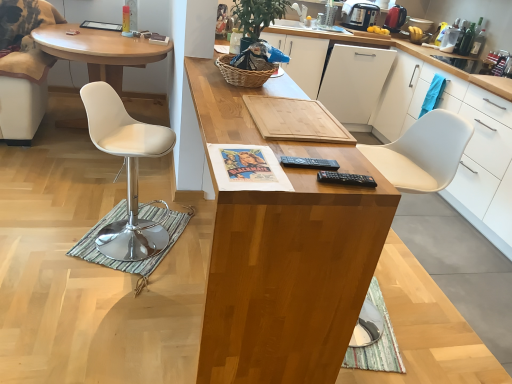
The width and height of the screenshot is (512, 384). I want to click on free space to the left of wooden at center, acting as the second desk starting from the left, so click(88, 261).